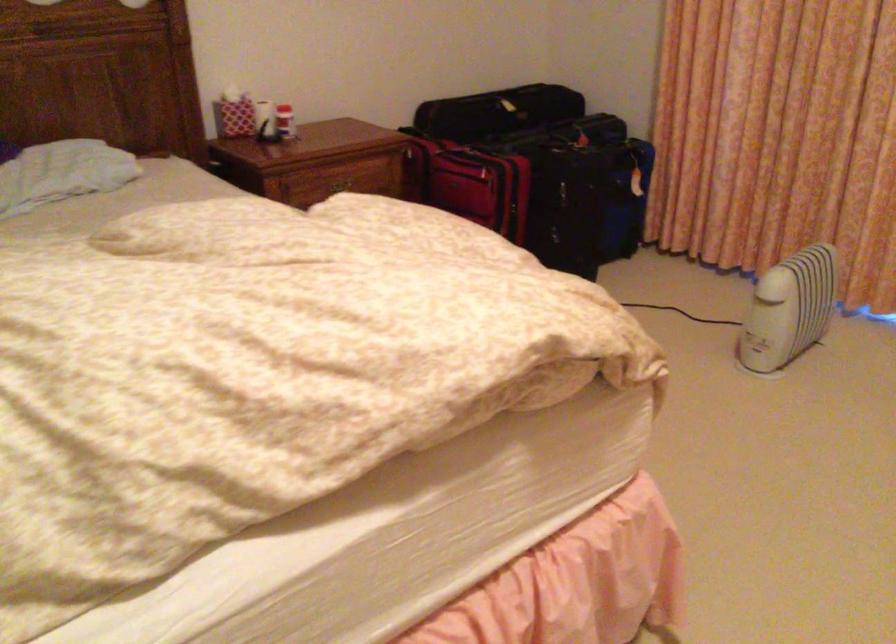
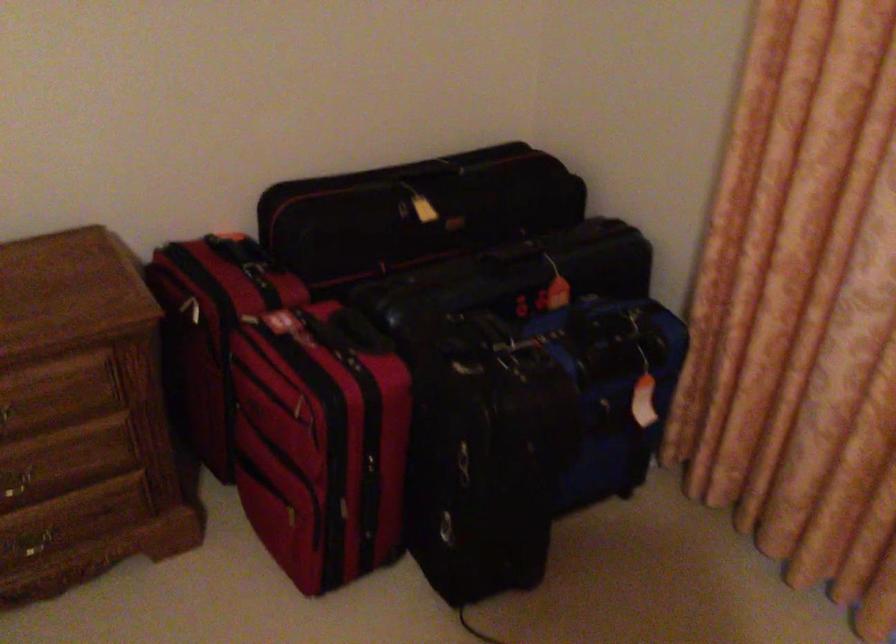
Question: In a continuous first-person perspective shot, in which direction is the camera moving?

Choices:
 (A) Left
 (B) Right
 (C) Forward
 (D) Backward

Answer: (C)